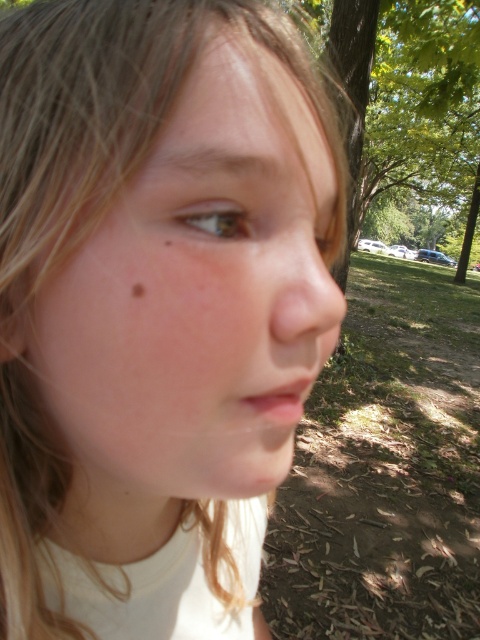
Looking at this image, you are standing in the park and see two points in the image. The first point is at coordinates point (218, 419) and the second point is at point (143, 291). Which point is closer to you?

Point (218, 419) is further to the viewer than point (143, 291), so the point closer to you is point (143, 291).

Based on the scene description, which object is taller between the smooth skin face at center and the brown matte freckle at lower left?

The smooth skin face at center is taller than the brown matte freckle at lower left.